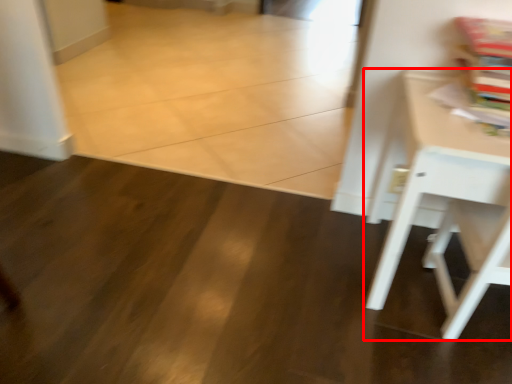
Question: Observing the image, what is the correct spatial positioning of table (annotated by the red box) in reference to magazine?

Choices:
 (A) right
 (B) left

Answer: (B)